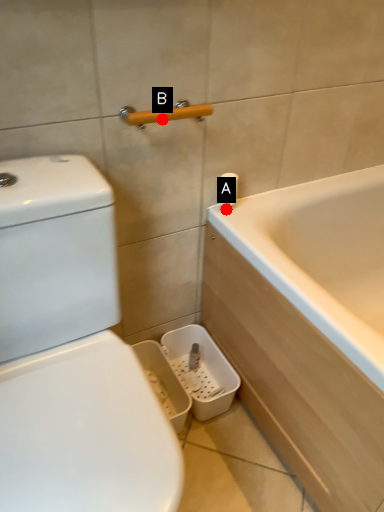
Question: Two points are circled on the image, labeled by A and B beside each circle. Which of the following is the closest to the observer?

Choices:
 (A) A is closer
 (B) B is closer

Answer: (B)